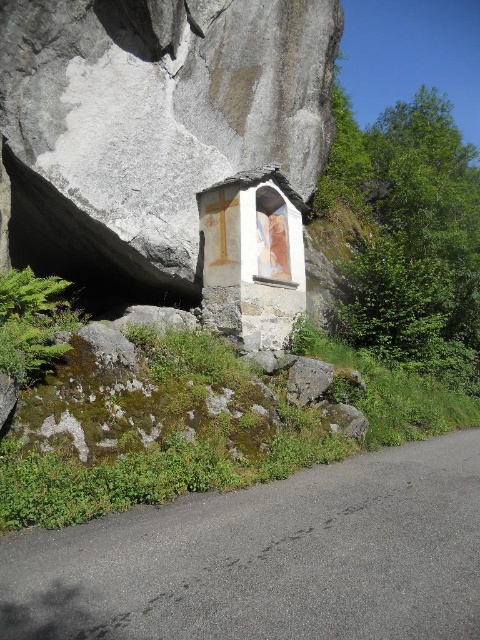
Consider the image. You are an architect designing a new garden path that needs to pass between the smooth gray rock at center and the white painted stone chapel at center. Based on the scene description, which object should the path be closer to in order to accommodate their heights?

The smooth gray rock at center is taller than the white painted stone chapel at center. Therefore, the path should be closer to the shorter white painted stone chapel at center to ensure adequate clearance for taller structures.

You are a hiker who wants to reach the white painted stone chapel at center. From your current position on the asphalt road at lower center, which direction should you walk to get closer to the chapel?

Since the asphalt road at lower center is in front of the white painted stone chapel at center, you should walk backward or turn around to face the chapel and then walk forward to get closer.